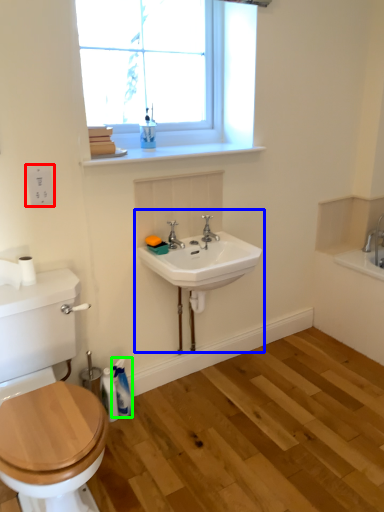
Question: Estimate the real-world distances between objects in this image. Which object is farther from electric outlet (highlighted by a red box), sink (highlighted by a blue box) or toiletry (highlighted by a green box)?

Choices:
 (A) sink
 (B) toiletry

Answer: (B)